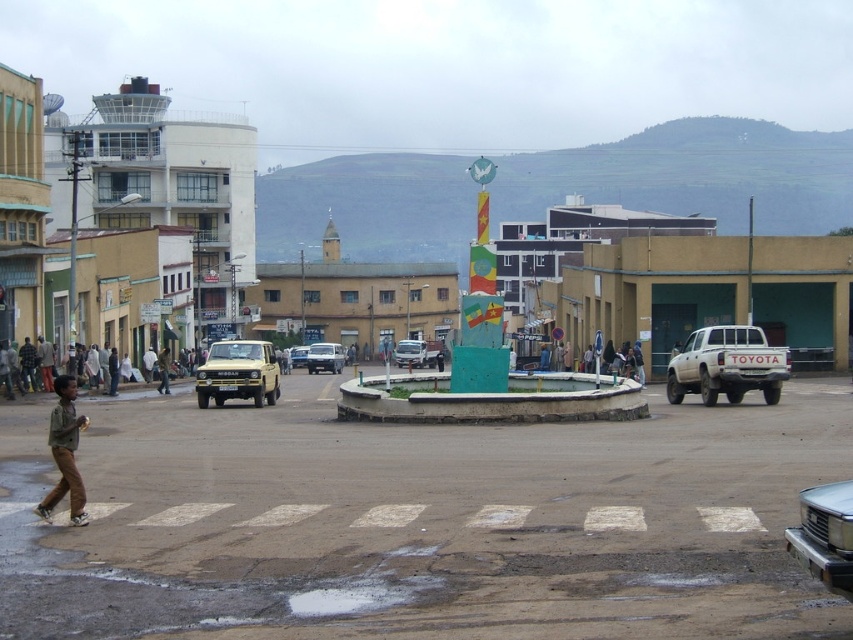
Question: Which point appears closest to the camera in this image?

Choices:
 (A) (51, 454)
 (B) (693, 362)

Answer: (A)

Question: Which is farther from the yellow matte truck at center-left?

Choices:
 (A) brown cotton shirt at left
 (B) brown cotton shirt at lower left
 (C) metallic silver car at center
 (D) matte silver van at center

Answer: (D)

Question: Which of the following is the farthest from the observer?

Choices:
 (A) (334, 360)
 (B) (169, 548)
 (C) (160, 392)

Answer: (A)

Question: Does green concrete plaza at center lie behind brown leather jacket at lower left?

Choices:
 (A) no
 (B) yes

Answer: (A)

Question: From the image, what is the correct spatial relationship of silver metallic car at lower right in relation to matte silver van at center?

Choices:
 (A) above
 (B) below

Answer: (A)

Question: Does silver metallic car at lower right have a greater width compared to matte silver van at center?

Choices:
 (A) yes
 (B) no

Answer: (B)